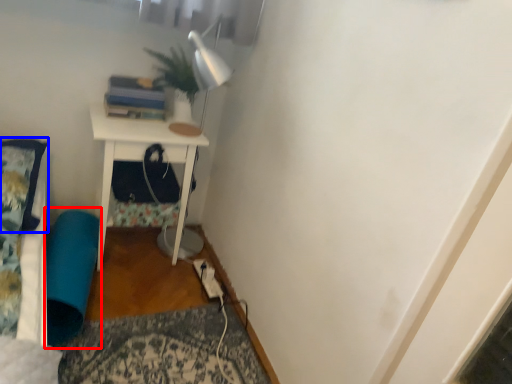
Question: Which object appears closest to the camera in this image, bean bag chair (highlighted by a red box) or pillow (highlighted by a blue box)?

Choices:
 (A) bean bag chair
 (B) pillow

Answer: (B)